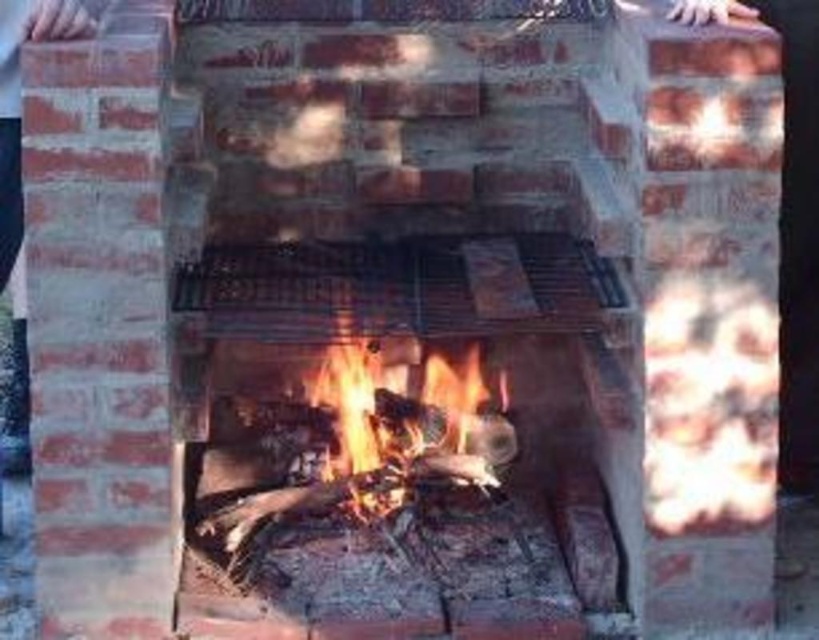
Looking at this image, you are a firefighter assessing the fireplace. You need to determine if the flames from the flaming wood at center could potentially reach the black metal grill at center. Based on their heights, can the flames reach the grill?

The black metal grill at center is shorter than the flaming wood at center, so the flames from the flaming wood at center could potentially reach the grill since the flames are taller than the grill.

You are standing in a living room and want to take a photo of the black metal grill at center. If your camera has a maximum focus range of 3 meters, will it be able to capture the grill clearly?

The black metal grill at center and camera are 3.24 meters apart, so the camera cannot focus on the grill because it is beyond the 3 meter range.